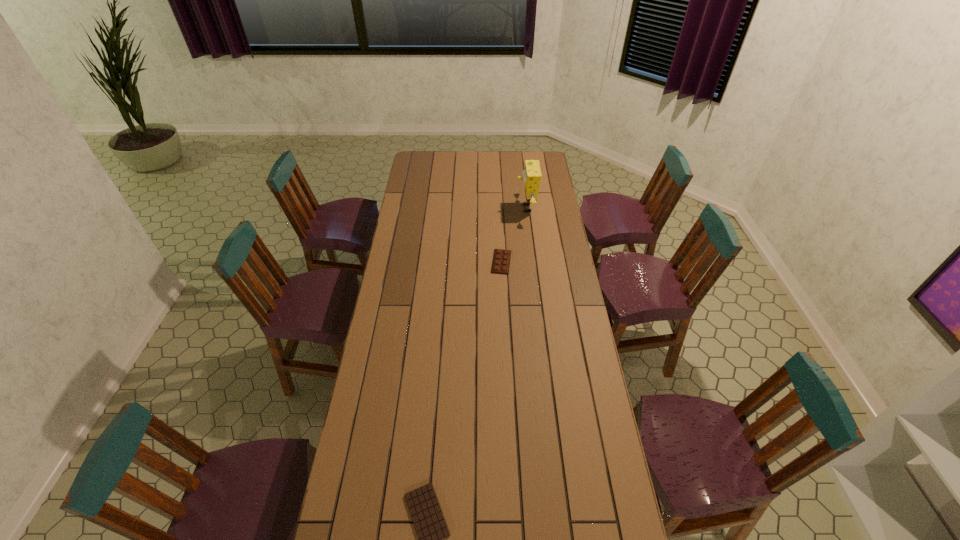
Image resolution: width=960 pixels, height=540 pixels. Identify the location of the tallest object. (532, 175).

The height and width of the screenshot is (540, 960). Find the location of `the farthest object`. the farthest object is located at coordinates (532, 175).

In order to click on the second farthest object in this screenshot , I will do `click(501, 258)`.

Where is `the second shortest object`? This screenshot has height=540, width=960. the second shortest object is located at coordinates (501, 258).

The height and width of the screenshot is (540, 960). Identify the location of vacant space located on the front-facing side of the rightmost object. (458, 208).

Find the location of a particular element. Image resolution: width=960 pixels, height=540 pixels. free space located on the front-facing side of the rightmost object is located at coordinates [450, 208].

You are a GUI agent. You are given a task and a screenshot of the screen. Output one action in this format:
    pyautogui.click(x=<x>, y=<y>)
    Task: Click on the free location located 0.350m on the front-facing side of the rightmost object
    This screenshot has width=960, height=540.
    Given the screenshot: What is the action you would take?
    pyautogui.click(x=450, y=208)

Identify the location of free space located on the left of the second shortest object. (426, 262).

This screenshot has width=960, height=540. I want to click on object that is at the right edge, so click(532, 175).

Image resolution: width=960 pixels, height=540 pixels. I want to click on vacant space at the left edge of the desktop, so click(x=368, y=399).